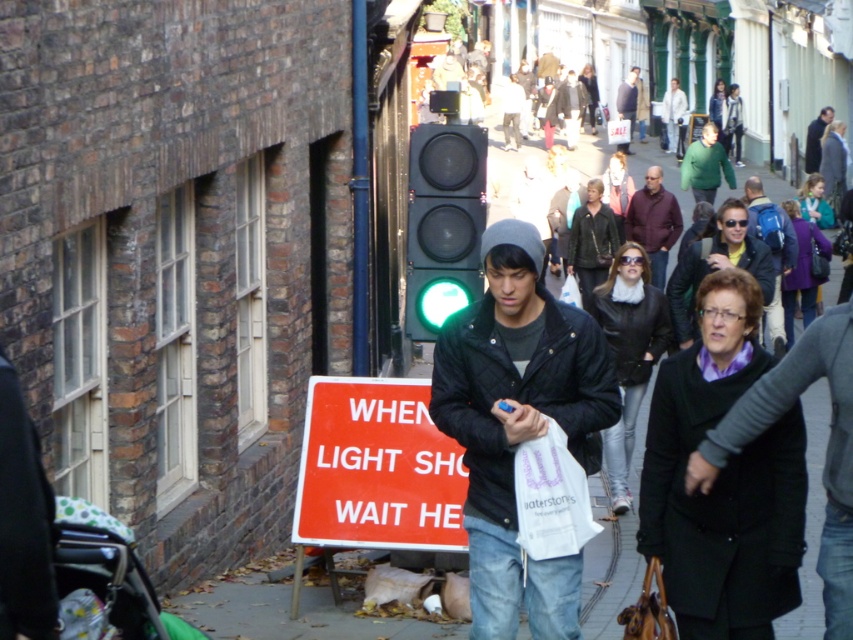
Question: Is red plastic sign at lower center positioned before dark gray knit hat at center?

Choices:
 (A) yes
 (B) no

Answer: (A)

Question: Does maroon wool sweater at center have a greater width compared to green fuzzy sweater at center?

Choices:
 (A) no
 (B) yes

Answer: (B)

Question: Which of the following is the farthest from the observer?

Choices:
 (A) black quilted jacket at center
 (B) red plastic sign at lower center
 (C) dark gray knit hat at center
 (D) green glass traffic light at center

Answer: (C)

Question: Which object is the closest to the red plastic sign at lower center?

Choices:
 (A) dark gray knit hat at center
 (B) white cotton jacket at center
 (C) green glass traffic light at center
 (D) dark blue jacket at center

Answer: (C)

Question: Is green glass traffic light at center smaller than dark gray knit hat at center?

Choices:
 (A) no
 (B) yes

Answer: (B)

Question: Which object is farther from the camera taking this photo?

Choices:
 (A) green glass traffic light at center
 (B) dark blue jacket at center
 (C) green fuzzy sweater at center

Answer: (B)